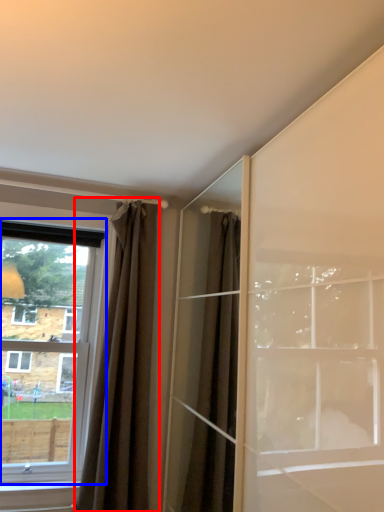
Question: Among these objects, which one is nearest to the camera, curtain (highlighted by a red box) or window (highlighted by a blue box)?

Choices:
 (A) curtain
 (B) window

Answer: (A)